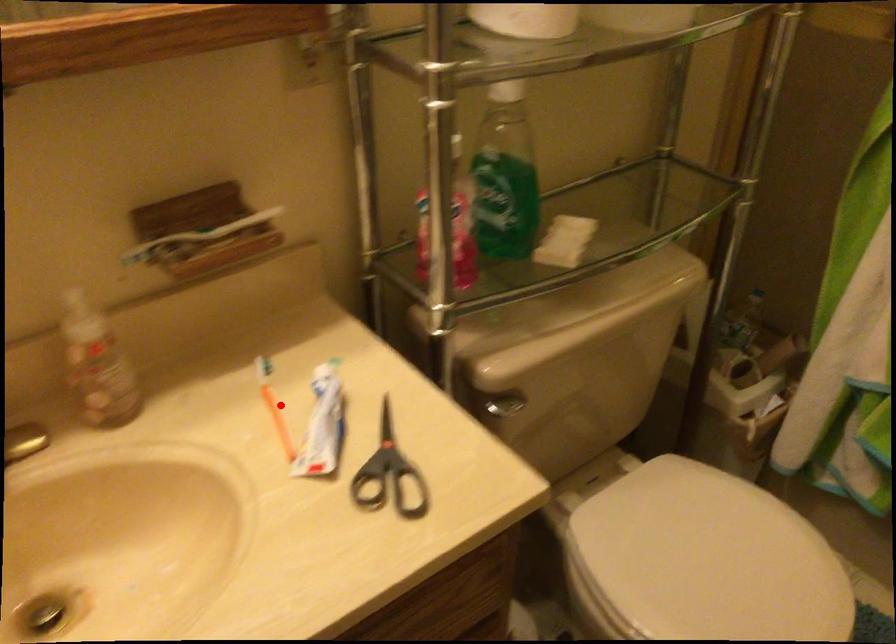
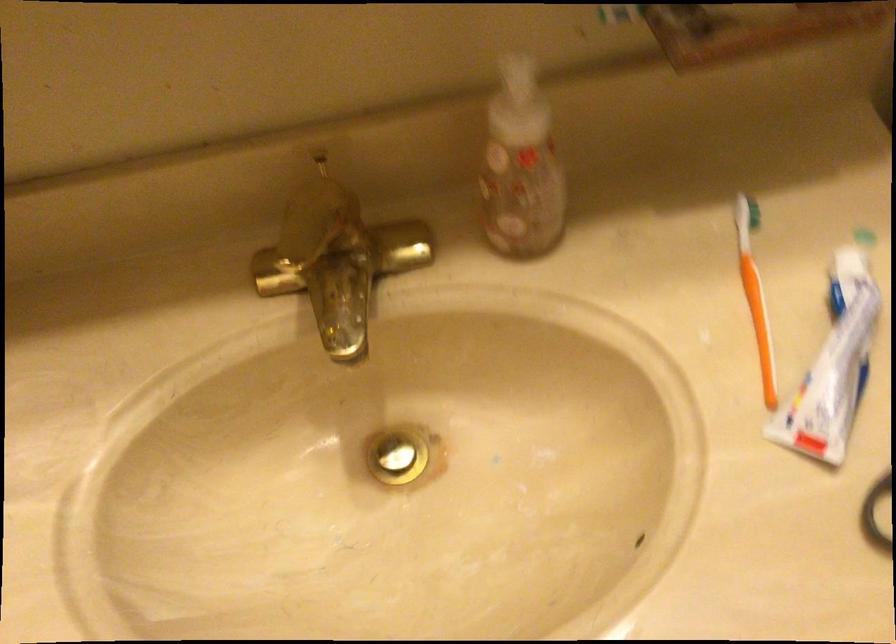
Where in the second image is the point corresponding to the highlighted location from the first image?

(755, 295)